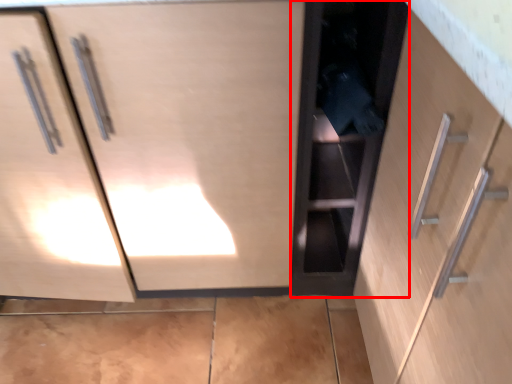
Question: Where is cabinetry (annotated by the red box) located in relation to cabinetry in the image?

Choices:
 (A) right
 (B) left

Answer: (A)